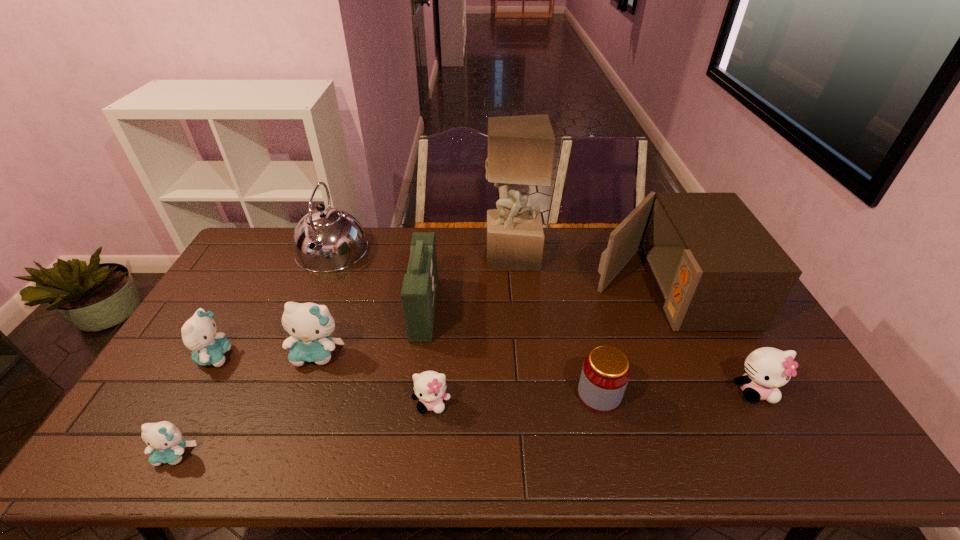
I want to click on kettle present at the far edge, so click(x=327, y=239).

At what (x,y) coordinates should I click in order to perform the action: click on microwave oven positioned at the far edge. Please return your answer as a coordinate pair (x, y). Looking at the image, I should click on (718, 269).

The width and height of the screenshot is (960, 540). I want to click on object situated at the near edge, so click(x=165, y=443).

Image resolution: width=960 pixels, height=540 pixels. Identify the location of microwave oven situated at the right edge. (718, 269).

Locate an element on the screen. kitten that is positioned at the right edge is located at coordinates (766, 369).

At what (x,y) coordinates should I click in order to perform the action: click on object that is at the near left corner. Please return your answer as a coordinate pair (x, y). The height and width of the screenshot is (540, 960). Looking at the image, I should click on (165, 443).

Where is `object at the far right corner`? This screenshot has height=540, width=960. object at the far right corner is located at coordinates (718, 269).

Find the location of a particular element. blank space at the far edge of the desktop is located at coordinates tap(587, 234).

I want to click on free space at the near edge, so click(512, 437).

Identify the location of vacant space at the left edge of the desktop. (228, 308).